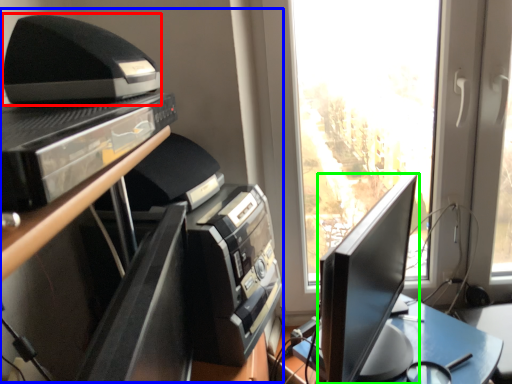
Question: Considering the real-world distances, which object is closest to printer (highlighted by a red box)? entertainment center (highlighted by a blue box) or computer monitor (highlighted by a green box).

Choices:
 (A) entertainment center
 (B) computer monitor

Answer: (A)